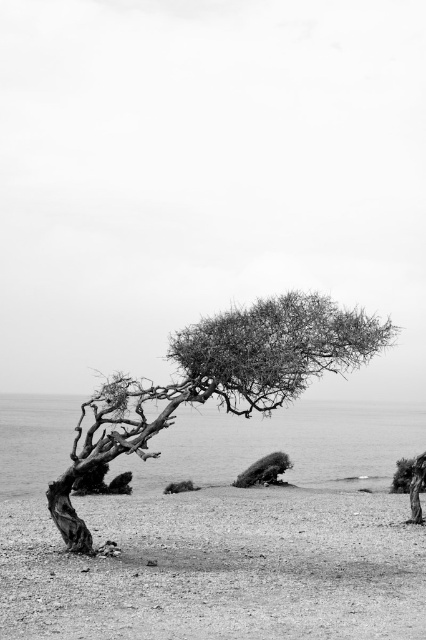
You are standing at the edge of the smooth sand at lower left and want to reach the thorny bark tree at center. Which direction should you move to get closer to the tree?

You should move towards the center direction to reach the thorny bark tree at center from the smooth sand at lower left.

You are standing at the edge of the scene and want to walk towards the fuzzy fur animal at center. Which direction should you move to first reach the smooth sand at lower left before proceeding to the animal?

To first reach the smooth sand at lower left before proceeding to the fuzzy fur animal at center, you should move towards the lower left direction since the smooth sand at lower left is closer to the viewer than the animal.

You are standing at the base of the solitary tree in the image and want to walk to the point labeled point (68,636). Which direction should you go relative to the other point labeled point (167,492)?

Since point (68,636) is closer to the viewer than point (167,492), you should walk towards the direction where point (68,636) is located, which is closer to you compared to point (167,492).